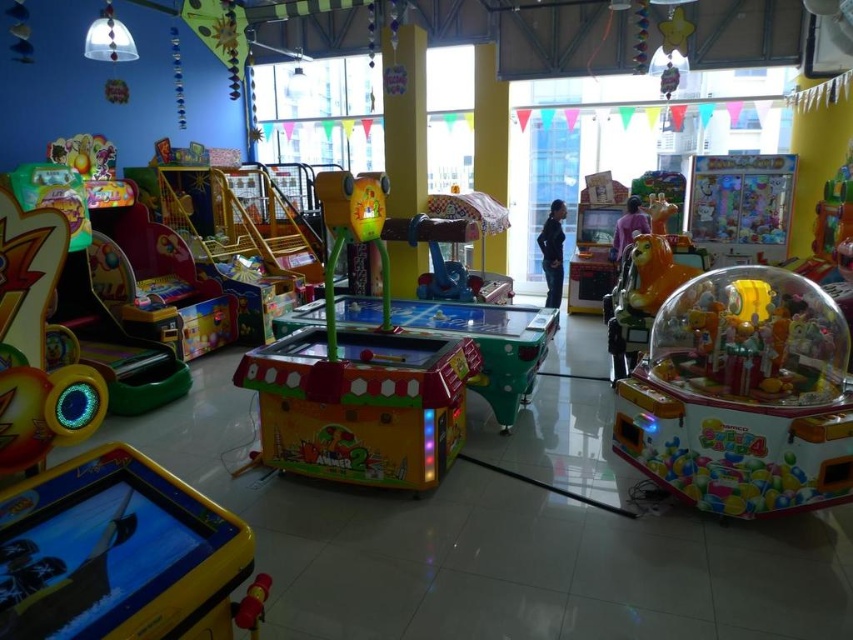
You are a maintenance technician with a 2.5 meter long ladder. You need to reach a high shelf that is between the matte yellow plastic game at center and the black matte pants at center. Can you safely place the ladder between them without it overlapping either object?

The distance between the matte yellow plastic game at center and the black matte pants at center is 4.57 meters. Since the ladder is only 2.5 meters long, there is enough space to place it between them safely without overlapping either object.

You are a child who wants to reach the top of the translucent plastic claw machine at right and the purple matte jacket at center. Which object is taller and requires you to stand on your tiptoes to reach?

The translucent plastic claw machine at right is taller than the purple matte jacket at center, so you would need to stand on your tiptoes to reach its top.

You are a customer trying to decide between two items displayed at the center of the store. The items are the black matte pants at center and the purple matte jacket at center. Which item is narrower in width?

The black matte pants at center is thinner than the purple matte jacket at center, so the black matte pants at center is narrower in width.